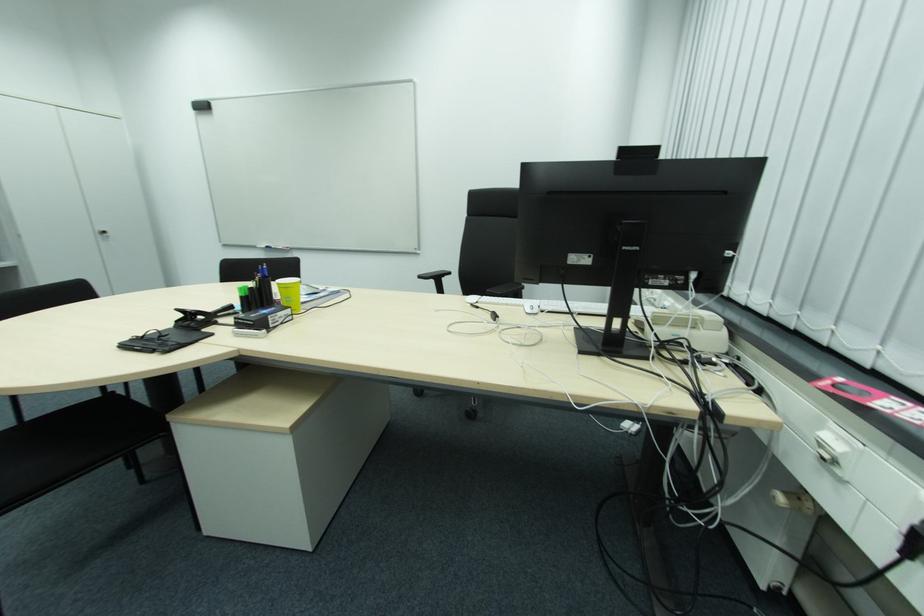
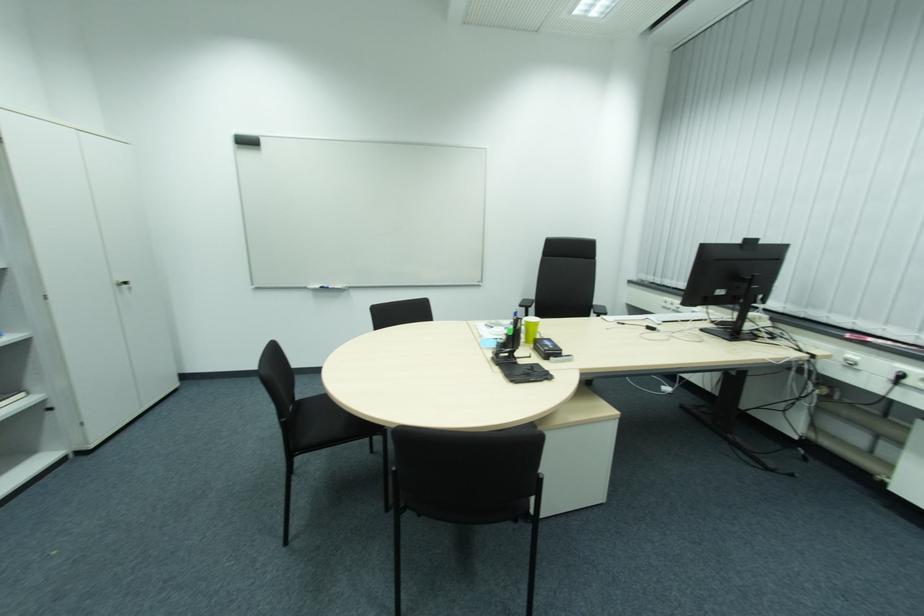
Where in the second image is the point corresponding to pixel 103 235 from the first image?

(122, 286)